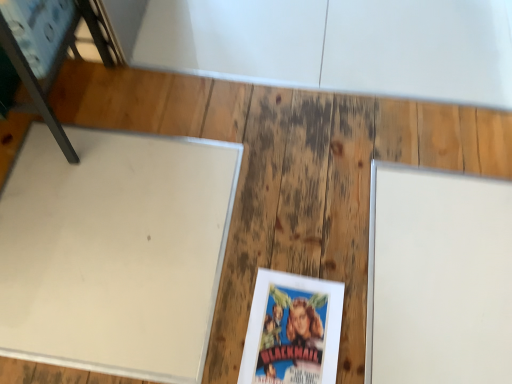
I want to click on blank space situated above matte paper book at center (from a real-world perspective), so click(292, 332).